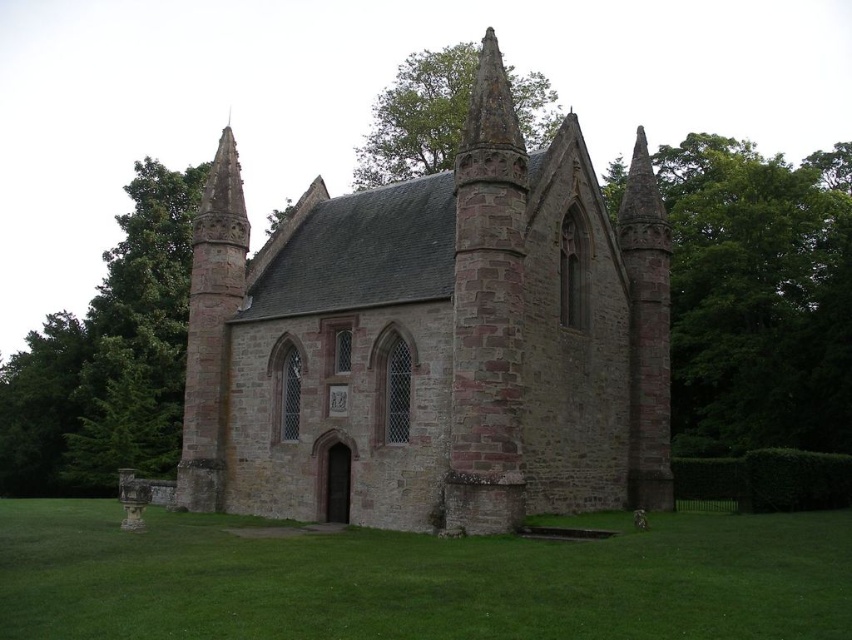
Who is lower down, brown stone church at center or green leafy tree at upper center?

brown stone church at center

Does brown stone church at center have a greater height compared to green leafy tree at upper center?

No, brown stone church at center is not taller than green leafy tree at upper center.

Which is behind, point (377, 508) or point (463, 104)?

The point (463, 104) is behind.

Find the location of a particular element. brown stone church at center is located at coordinates (433, 340).

Does brown stone church at center have a lesser height compared to green grass at lower center?

In fact, brown stone church at center may be taller than green grass at lower center.

Does brown stone church at center have a lesser width compared to green grass at lower center?

Correct, brown stone church at center's width is less than green grass at lower center's.

Does point (401, 516) come behind point (371, 554)?

Yes, it is behind point (371, 554).

Locate an element on the screen. brown stone church at center is located at coordinates (433, 340).

Which is above, brown stone church at center or green leafy tree at right?

green leafy tree at right is higher up.

Describe the element at coordinates (433, 340) in the screenshot. I see `brown stone church at center` at that location.

Which is behind, point (442, 376) or point (746, 372)?

Point (746, 372)

At what (x,y) coordinates should I click in order to perform the action: click on brown stone church at center. Please return your answer as a coordinate pair (x, y). The width and height of the screenshot is (852, 640). Looking at the image, I should click on (433, 340).